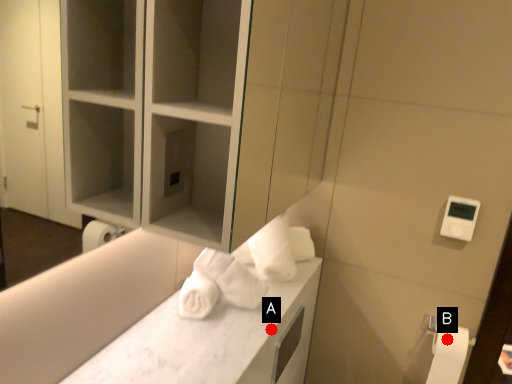
Question: Two points are circled on the image, labeled by A and B beside each circle. Which point is farther from the camera taking this photo?

Choices:
 (A) A is further
 (B) B is further

Answer: (B)